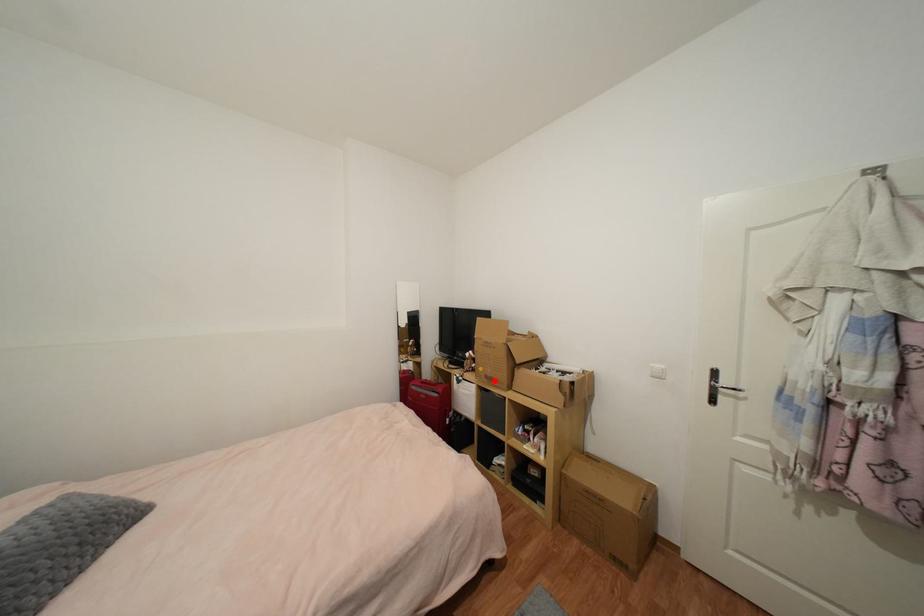
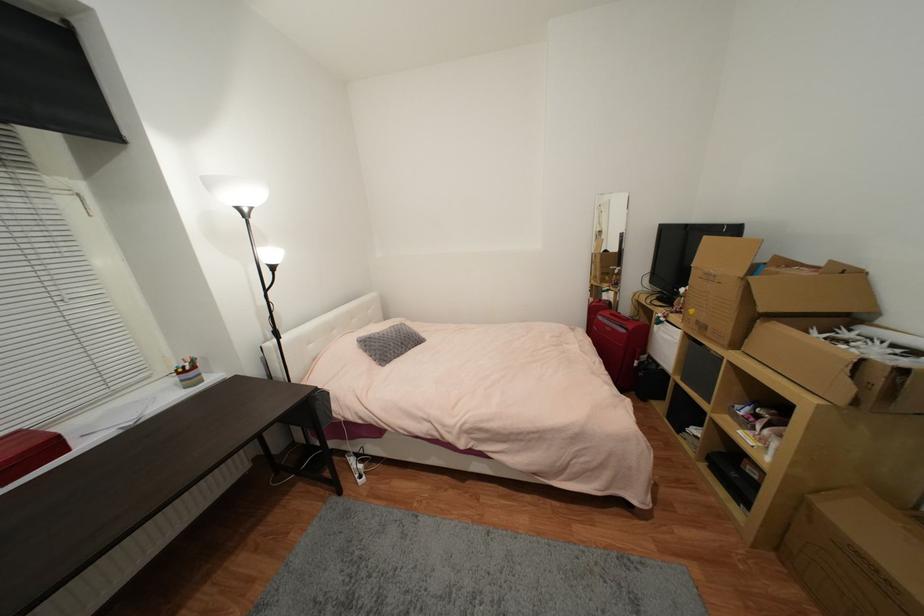
Question: I am providing you with two images of the same scene from different viewpoints. Image1 has a red point marked. In image2, the corresponding 3D location appears at what relative position? Reply with the corresponding letter.

Choices:
 (A) Closer
 (B) Farther

Answer: (A)